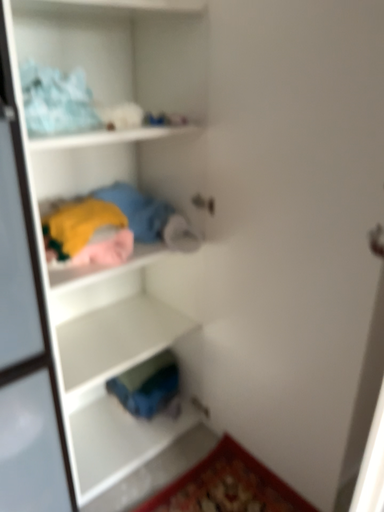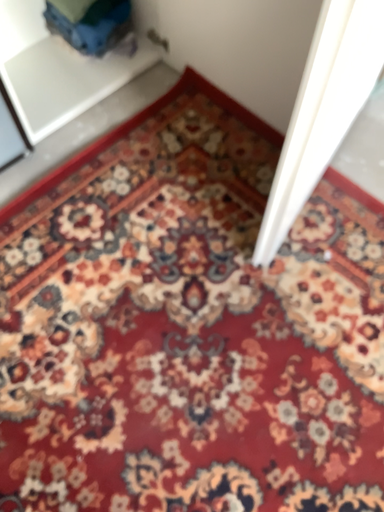
Question: How did the camera likely rotate when shooting the video?

Choices:
 (A) rotated upward
 (B) rotated downward

Answer: (B)